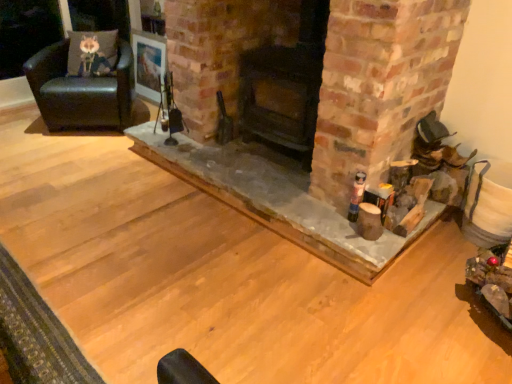
Where is `vacant area that is in front of dark brown wood stove at center, positioned as the 1th fireplace in right-to-left order`? vacant area that is in front of dark brown wood stove at center, positioned as the 1th fireplace in right-to-left order is located at coordinates (281, 194).